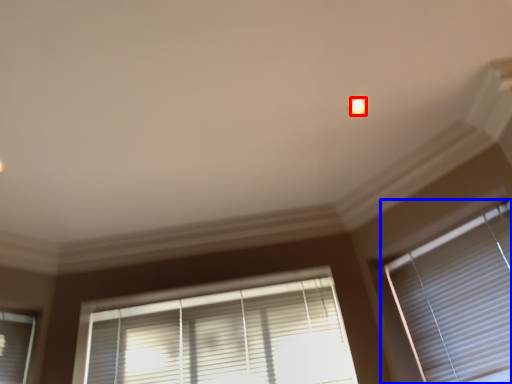
Question: Which object is further to the camera taking this photo, light (highlighted by a red box) or window blind (highlighted by a blue box)?

Choices:
 (A) light
 (B) window blind

Answer: (A)